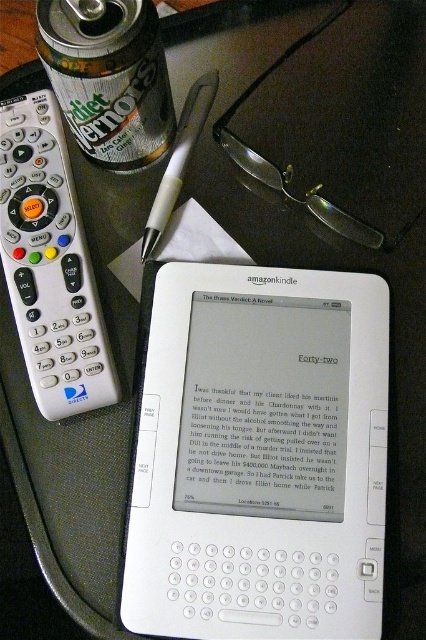
What object is located at the coordinates point (259, 456) on the table?

The point (259, 456) marks the white plastic kindle at center.

You are a delivery robot that needs to place a small package on the table. The table has an Amazon Kindle e reader displaying a book titled The Brass Verdict A Novel and a white remote control at left. Where should you place the package so it doesn t interfere with the existing items? Please specify coordinates based on the table s coordinate system where the bottom left corner is 0,0 and the top right is 1,1. The existing items are located at point (49, 262).

The existing items are located at point (49, 262), so placing the package away from that coordinate would prevent interference. A safe location could be near the bottom right corner of the table, such as coordinates 0.8, 0.2.

You are a delivery robot that needs to place a small package between the white plastic kindle at center and the white plastic pen at center on the table. The package is 30 centimeters long. Can you fit it between them?

The distance between the white plastic kindle at center and the white plastic pen at center is 32.12 centimeters. Since the package is 30 centimeters long, it can fit between them as there is enough space.